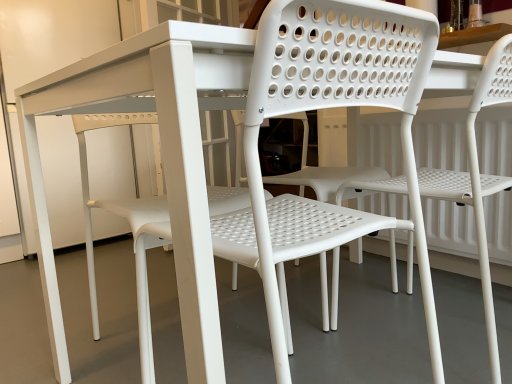
Question: From a real-world perspective, is white plastic chair at center under white plastic chair at center, the second chair from the left?

Choices:
 (A) yes
 (B) no

Answer: (A)

Question: From a real-world perspective, is white plastic chair at center on white plastic chair at center, the 1th chair positioned from the right?

Choices:
 (A) no
 (B) yes

Answer: (A)

Question: Considering the relative sizes of white plastic chair at center and white plastic chair at center, the second chair from the left, in the image provided, is white plastic chair at center taller than white plastic chair at center, the second chair from the left,?

Choices:
 (A) yes
 (B) no

Answer: (B)

Question: Is white plastic chair at center to the right of white plastic chair at center, the second chair from the left, from the viewer's perspective?

Choices:
 (A) no
 (B) yes

Answer: (A)

Question: Is white plastic chair at center, the second chair from the left, surrounded by white plastic chair at center?

Choices:
 (A) no
 (B) yes

Answer: (A)

Question: Is white plastic chair at center looking in the opposite direction of white plastic chair at center, the 1th chair positioned from the right?

Choices:
 (A) no
 (B) yes

Answer: (A)

Question: Is white plastic chair at center, which is counted as the second chair, starting from the right, far from white plastic chair at center, the 1th chair positioned from the right?

Choices:
 (A) no
 (B) yes

Answer: (A)

Question: Does white plastic chair at center, the 1th chair when ordered from left to right, have a larger size compared to white plastic chair at center, the second chair from the left?

Choices:
 (A) no
 (B) yes

Answer: (A)

Question: Does white plastic chair at center, which is counted as the second chair, starting from the right, turn towards white plastic chair at center, the second chair from the left?

Choices:
 (A) yes
 (B) no

Answer: (B)

Question: Is white plastic chair at center, the 1th chair when ordered from left to right, positioned before white plastic chair at center, the second chair from the left?

Choices:
 (A) no
 (B) yes

Answer: (B)

Question: Is the depth of white plastic chair at center, which is counted as the second chair, starting from the right, greater than that of white plastic chair at center, the 1th chair positioned from the right?

Choices:
 (A) no
 (B) yes

Answer: (A)

Question: From a real-world perspective, is white plastic chair at center, the 1th chair when ordered from left to right, positioned over white plastic chair at center, the 1th chair positioned from the right, based on gravity?

Choices:
 (A) no
 (B) yes

Answer: (B)

Question: Can you confirm if white plastic chair at center, the second chair from the left, is shorter than white plastic chair at center?

Choices:
 (A) no
 (B) yes

Answer: (A)